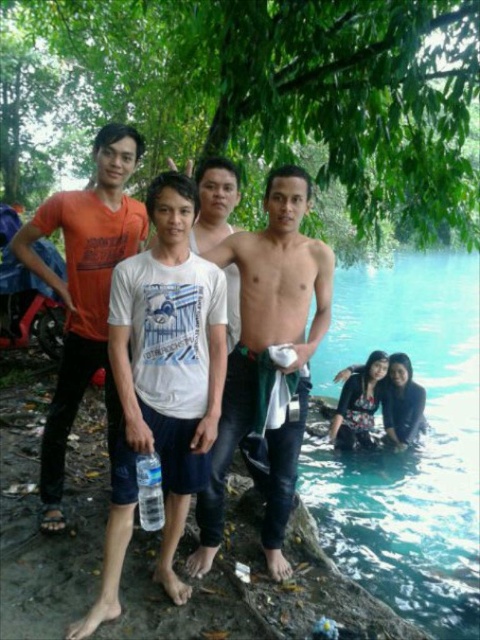
Question: Which point is farther from the camera taking this photo?

Choices:
 (A) (459, 602)
 (B) (305, 289)

Answer: (A)

Question: Considering the real-world distances, which object is farthest from the muscular tan skin at center?

Choices:
 (A) white cotton t-shirt at center
 (B) orange cotton t-shirt at left
 (C) clear blue water at lower right
 (D) shiny metallic towel at center

Answer: (C)

Question: Does clear blue water at lower right have a smaller size compared to orange cotton t-shirt at left?

Choices:
 (A) yes
 (B) no

Answer: (B)

Question: Which point is farther from the camera taking this photo?

Choices:
 (A) (x=249, y=234)
 (B) (x=264, y=248)
 (C) (x=137, y=502)
 (D) (x=117, y=451)

Answer: (A)

Question: Is the position of clear blue water at lower right less distant than that of shiny metallic towel at center?

Choices:
 (A) no
 (B) yes

Answer: (A)

Question: Can you confirm if white cotton t-shirt at center is bigger than orange cotton t-shirt at left?

Choices:
 (A) yes
 (B) no

Answer: (B)